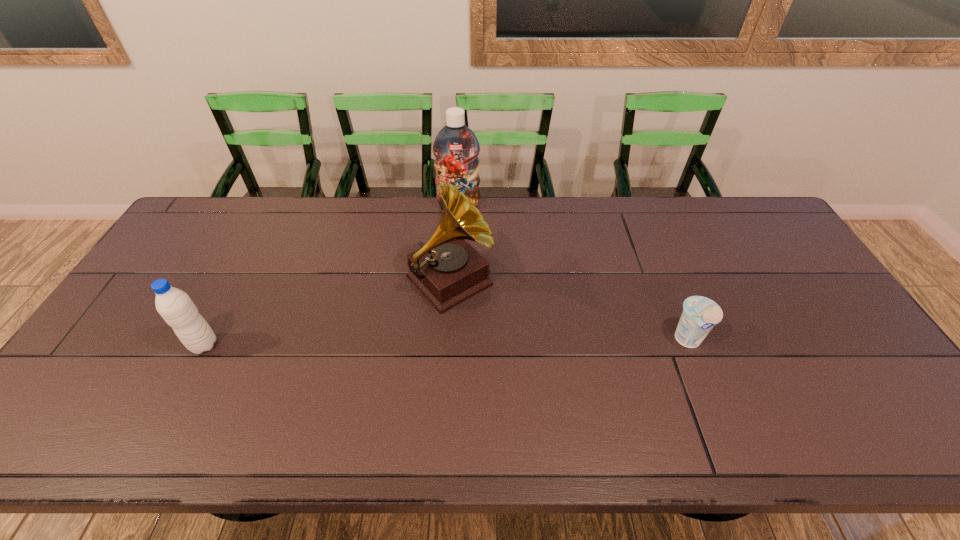
Where is `free space on the desktop that is between the leftmost object and the shortest object and is positioned from the horn of the phonograph record`? free space on the desktop that is between the leftmost object and the shortest object and is positioned from the horn of the phonograph record is located at coordinates (510, 342).

You are a GUI agent. You are given a task and a screenshot of the screen. Output one action in this format:
    pyautogui.click(x=<x>, y=<y>)
    Task: Click on the free space on the desktop that is between the leftmost object and the rightmost object and is positioned on the front label of the shampoo
    
    Given the screenshot: What is the action you would take?
    pyautogui.click(x=468, y=342)